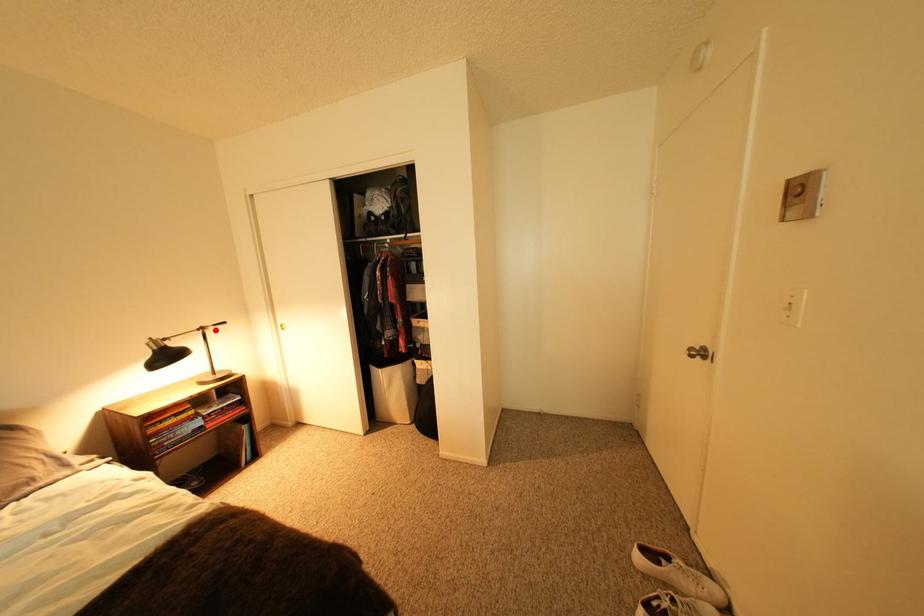
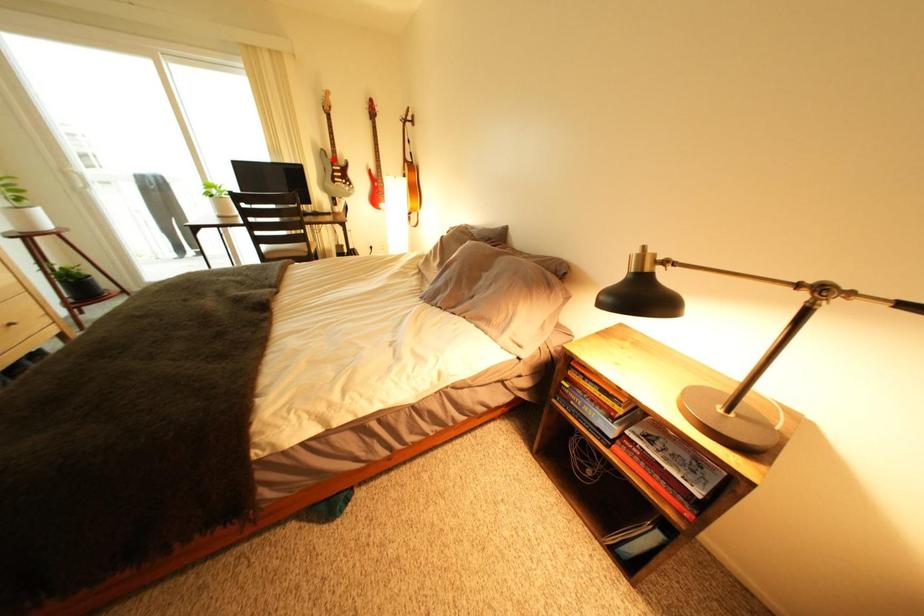
I am providing you with two images of the same scene from different viewpoints. A red point is marked on the first image and another point is marked on the second image. Does the point marked in image1 correspond to the same location as the one in image2?

No